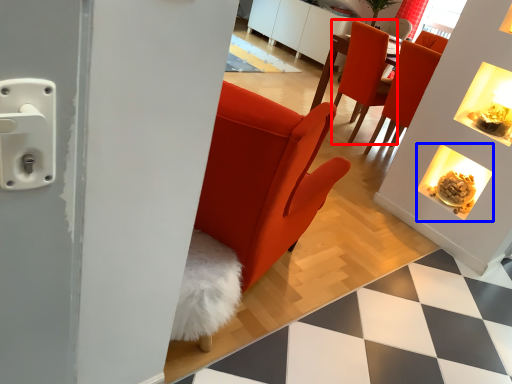
Question: Which object is closer to the camera taking this photo, chair (highlighted by a red box) or fireplace (highlighted by a blue box)?

Choices:
 (A) chair
 (B) fireplace

Answer: (B)